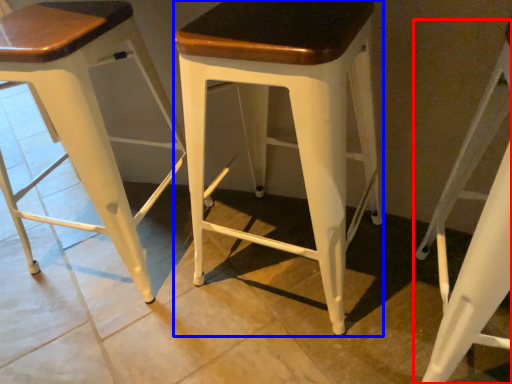
Question: Which point is further to the camera, stool (highlighted by a red box) or stool (highlighted by a blue box)?

Choices:
 (A) stool
 (B) stool

Answer: (B)